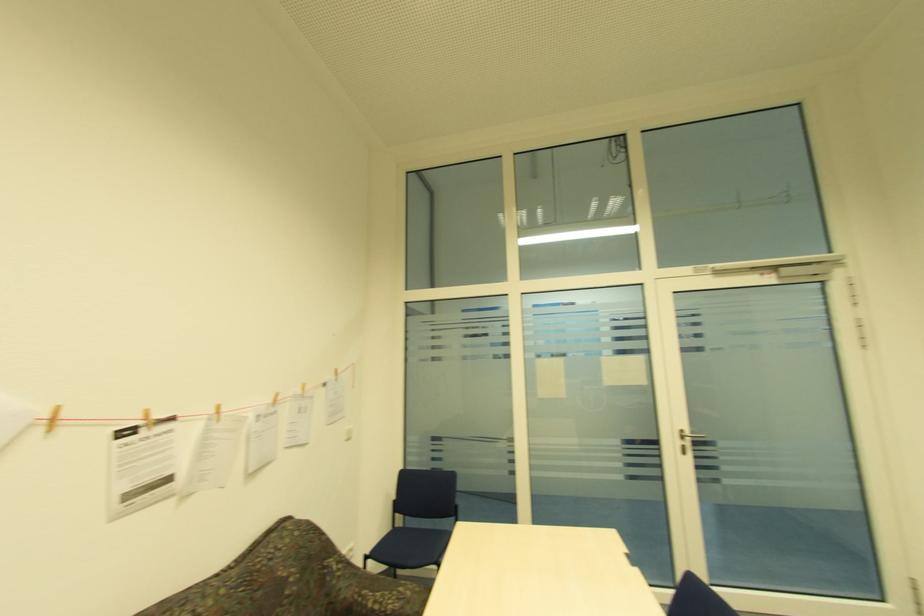
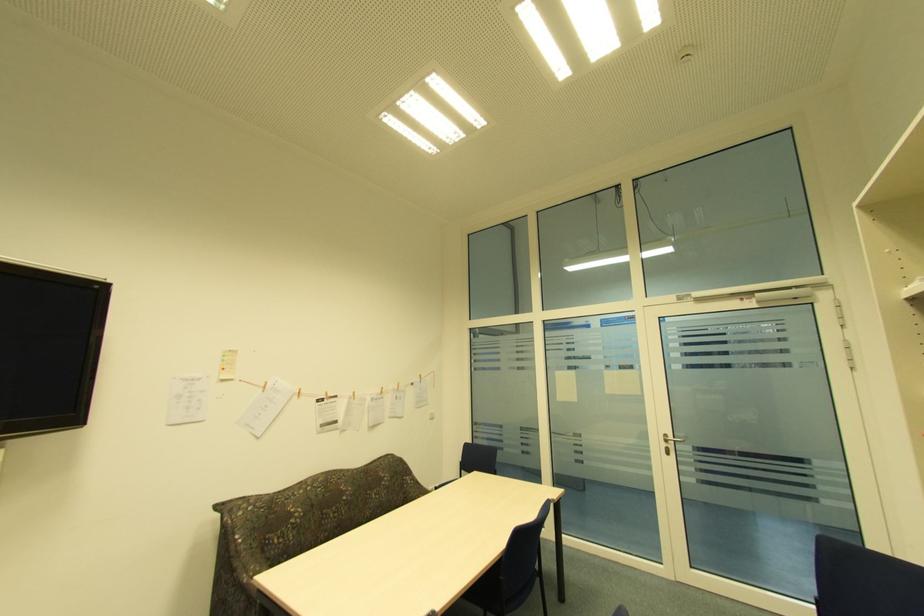
In the second image, find the point that corresponds to [682,444] in the first image.

(666, 445)